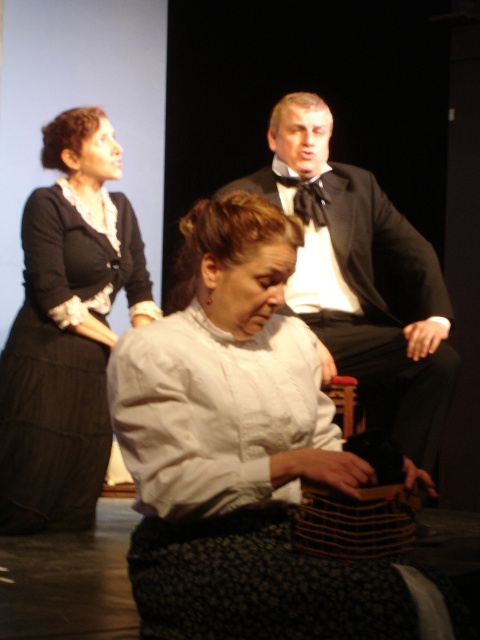
You are a costume designer working on a historical drama. You need to ensure that the white cotton blouse at center and the black satin tuxedo at upper center are proportionate to the actors wearing them. Given their sizes, which costume might require adjustments to better fit the actor?

The white cotton blouse at center is smaller than the black satin tuxedo at upper center. Since the tuxedo is larger, it might be designed for a taller or broader actor, while the blouse could be too small for the actor it is intended for, necessitating adjustments to ensure proper fit.

Where is the white cotton blouse at center located in the image?

The white cotton blouse at center is located at point (242, 452) in the image.

Based on the coordinates provided, which object is located at point (242,452) in the image?

The point (242,452) indicates the white cotton blouse at center.